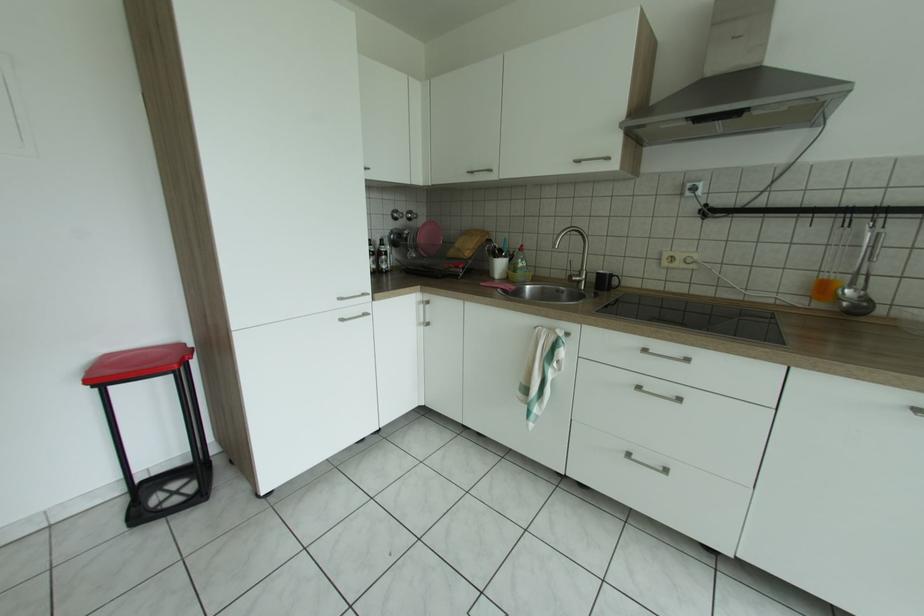
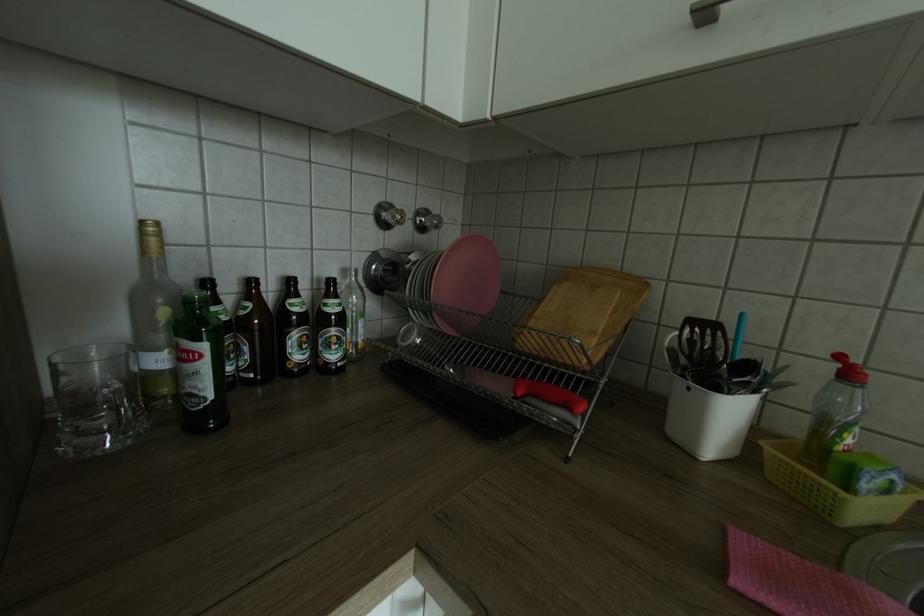
Question: What movement of the cameraman would produce the second image?

Choices:
 (A) Left
 (B) Right
 (C) Forward
 (D) Backward

Answer: (C)